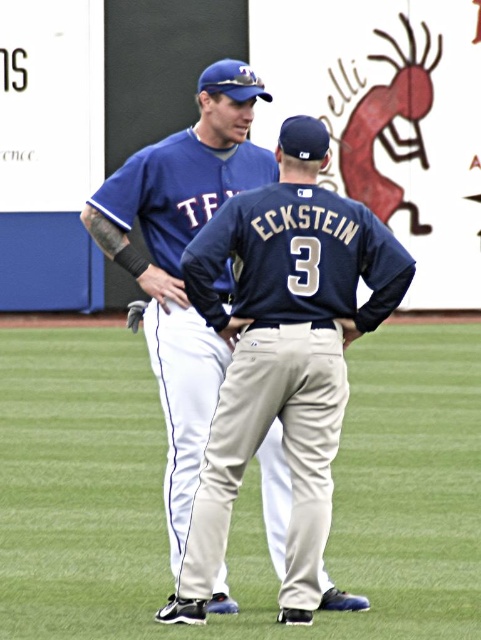
Question: Estimate the real-world distances between objects in this image. Which object is farther from the matte blue baseball cap at upper center?

Choices:
 (A) dark blue jersey at center
 (B) brown leather glove at center
 (C) white fabric pants at center

Answer: (C)

Question: Which point is farther from the camera taking this photo?

Choices:
 (A) (143, 305)
 (B) (261, 349)
 (C) (233, 88)
 (D) (244, 502)

Answer: (D)

Question: Among these points, which one is farthest from the camera?

Choices:
 (A) (353, 228)
 (B) (195, 452)
 (C) (141, 301)

Answer: (C)

Question: Does matte blue baseball cap at upper center come in front of brown leather glove at center?

Choices:
 (A) no
 (B) yes

Answer: (B)

Question: Does white fabric pants at center lie in front of dark blue jersey at center?

Choices:
 (A) yes
 (B) no

Answer: (B)

Question: Observing the image, what is the correct spatial positioning of dark blue jersey at center in reference to matte blue baseball cap at upper center?

Choices:
 (A) left
 (B) right

Answer: (B)